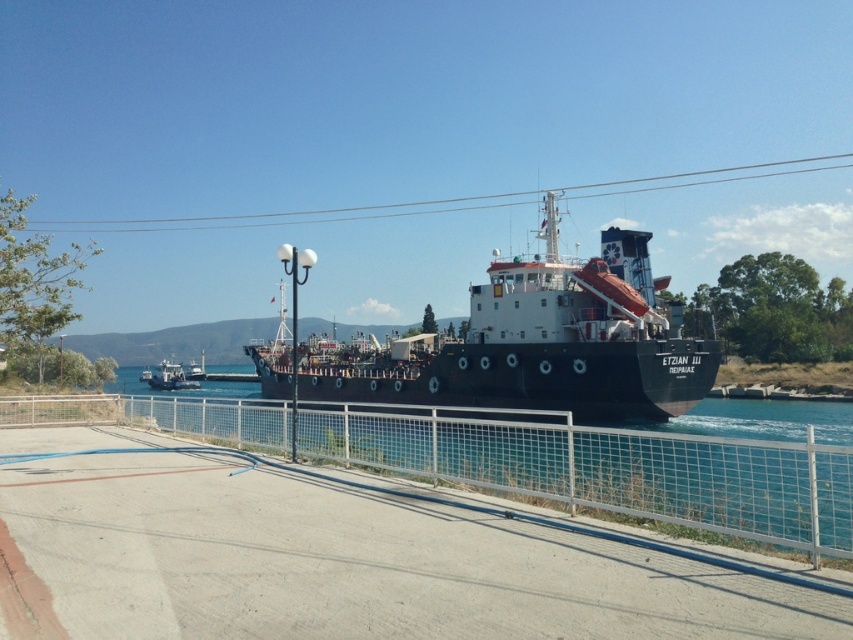
You are standing at the lamppost near the center of the frame. You want to walk to the point marked at coordinates (305, 436). How far will you have to walk?

The distance between the point marked at coordinates (305, 436) and the camera is 45.34 feet. Since you are standing at the lamppost near the center of the frame, which is the camera position, you will have to walk 45.34 feet to reach the point.

What is the exact coordinate of the metal mesh fence at center?

The metal mesh fence at center is located at point (606, 467).

You are standing on the pathway next to the fence and want to take a photo of the black matte ship at center and the metallic gray tugboat at lower left. Which one should you aim your camera towards first if you want to capture both in one shot without moving your position?

You should aim your camera towards the metallic gray tugboat at lower left first because the black matte ship at center is to the right of it, so capturing the tugboat first allows both objects to be included in the frame when panning right.